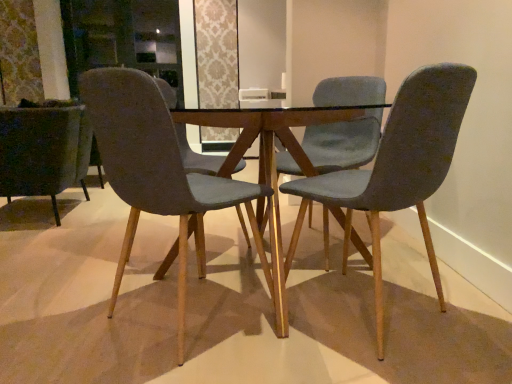
Question: Is velvet dark green armchair at left, which is the 4th chair in right-to-left order, further to camera compared to velvet grey chair at center, which is the third chair in right-to-left order?

Choices:
 (A) no
 (B) yes

Answer: (B)

Question: Does velvet dark green armchair at left, which is the 4th chair in right-to-left order, lie in front of velvet grey chair at center, which is the third chair in right-to-left order?

Choices:
 (A) yes
 (B) no

Answer: (B)

Question: Is velvet dark green armchair at left, marked as the first chair in a left-to-right arrangement, wider than velvet grey chair at center, which is the third chair in right-to-left order?

Choices:
 (A) yes
 (B) no

Answer: (A)

Question: Considering the relative sizes of velvet dark green armchair at left, which is the 4th chair in right-to-left order, and velvet grey chair at center, which is the third chair in right-to-left order, in the image provided, is velvet dark green armchair at left, which is the 4th chair in right-to-left order, smaller than velvet grey chair at center, which is the third chair in right-to-left order,?

Choices:
 (A) yes
 (B) no

Answer: (B)

Question: Considering the relative sizes of velvet dark green armchair at left, which is the 4th chair in right-to-left order, and velvet grey chair at center, which is the third chair in right-to-left order, in the image provided, is velvet dark green armchair at left, which is the 4th chair in right-to-left order, shorter than velvet grey chair at center, which is the third chair in right-to-left order,?

Choices:
 (A) no
 (B) yes

Answer: (B)

Question: In terms of width, does velvet grey chair at right, the 4th chair from the left, look wider or thinner when compared to velvet teal chair at center, the 3th chair when ordered from left to right?

Choices:
 (A) wide
 (B) thin

Answer: (B)

Question: Is velvet grey chair at right, which appears as the first chair when viewed from the right, bigger or smaller than velvet teal chair at center, acting as the 2th chair starting from the right?

Choices:
 (A) big
 (B) small

Answer: (B)

Question: Is velvet grey chair at right, the 4th chair from the left, taller or shorter than velvet teal chair at center, acting as the 2th chair starting from the right?

Choices:
 (A) short
 (B) tall

Answer: (A)

Question: Is velvet grey chair at right, the 4th chair from the left, in front of or behind velvet teal chair at center, acting as the 2th chair starting from the right, in the image?

Choices:
 (A) behind
 (B) front

Answer: (B)

Question: Considering the positions of point (349, 135) and point (25, 148), is point (349, 135) closer or farther from the camera than point (25, 148)?

Choices:
 (A) closer
 (B) farther

Answer: (A)

Question: Is velvet teal chair at center, acting as the 2th chair starting from the right, situated inside velvet dark green armchair at left, marked as the first chair in a left-to-right arrangement, or outside?

Choices:
 (A) inside
 (B) outside

Answer: (B)

Question: From a real-world perspective, is velvet teal chair at center, acting as the 2th chair starting from the right, physically located above or below velvet dark green armchair at left, marked as the first chair in a left-to-right arrangement?

Choices:
 (A) below
 (B) above

Answer: (B)

Question: Relative to velvet dark green armchair at left, marked as the first chair in a left-to-right arrangement, is velvet teal chair at center, acting as the 2th chair starting from the right, in front or behind?

Choices:
 (A) behind
 (B) front

Answer: (B)

Question: Is velvet dark green armchair at left, which is the 4th chair in right-to-left order, in front of or behind velvet grey chair at center, the 2th chair from the left, in the image?

Choices:
 (A) behind
 (B) front

Answer: (A)

Question: Considering the positions of point (88, 122) and point (202, 187), is point (88, 122) closer or farther from the camera than point (202, 187)?

Choices:
 (A) farther
 (B) closer

Answer: (A)